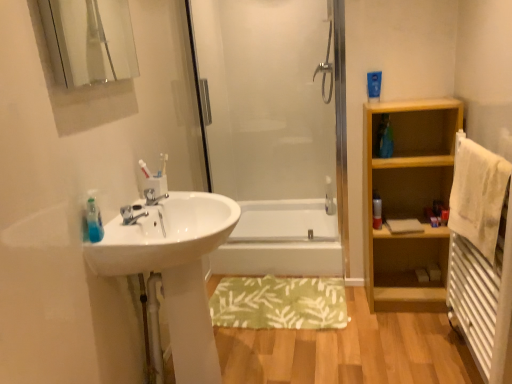
Locate an element on the screen. This screenshot has height=384, width=512. free location in front of light wood shelf at right is located at coordinates (408, 332).